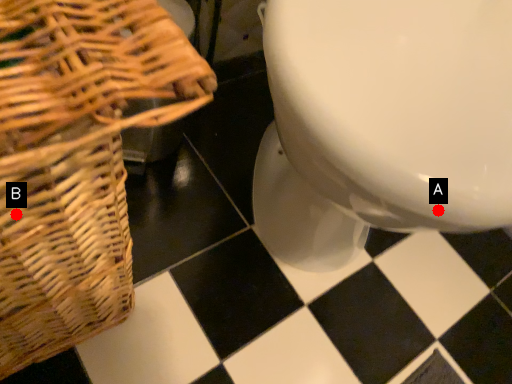
Question: Two points are circled on the image, labeled by A and B beside each circle. Which point is further to the camera?

Choices:
 (A) A is further
 (B) B is further

Answer: (A)